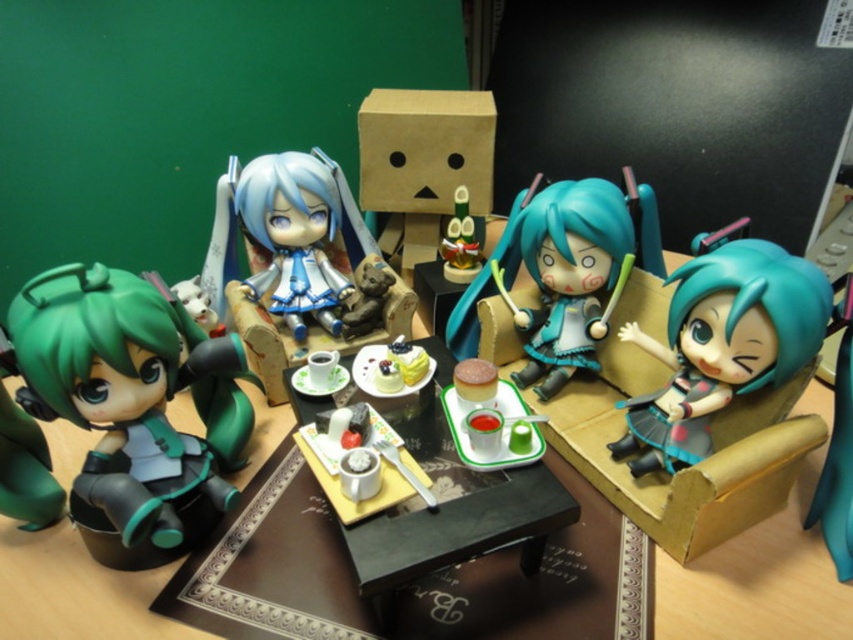
You are organizing a display of teal dolls and figures. You have a teal glossy doll at right and a teal matte figure at center. Which one should you place on the smaller shelf to fit properly?

The teal glossy doll at right is smaller than the teal matte figure at center, so it should be placed on the smaller shelf to fit properly.

You are organizing a display of anime figurines on a wooden table. You have a matte blue fabric doll at center that needs to be placed precisely. What are the coordinates where you should position it?

The matte blue fabric doll at center should be positioned at coordinates point (293, 237) as specified in the description.